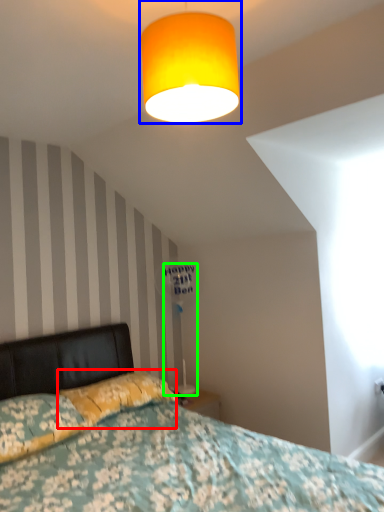
Question: Which is farther away from pillow (highlighted by a red box)? lamp (highlighted by a blue box) or table lamp (highlighted by a green box)?

Choices:
 (A) lamp
 (B) table lamp

Answer: (A)